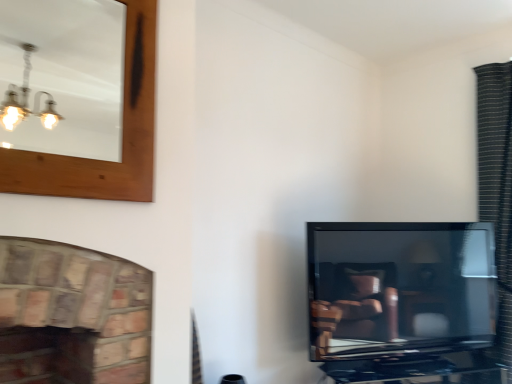
Question: Is the position of black textured curtain at right less distant than that of matte black tv at right?

Choices:
 (A) no
 (B) yes

Answer: (A)

Question: Is black textured curtain at right smaller than matte black tv at right?

Choices:
 (A) no
 (B) yes

Answer: (A)

Question: Can you confirm if black textured curtain at right is thinner than matte black tv at right?

Choices:
 (A) no
 (B) yes

Answer: (A)

Question: From the image's perspective, is black textured curtain at right under matte black tv at right?

Choices:
 (A) no
 (B) yes

Answer: (A)

Question: From a real-world perspective, does black textured curtain at right sit lower than matte black tv at right?

Choices:
 (A) yes
 (B) no

Answer: (B)

Question: Can you confirm if black textured curtain at right is positioned to the right of matte black tv at right?

Choices:
 (A) yes
 (B) no

Answer: (A)

Question: Is wooden-framed mirror at upper left located outside black textured curtain at right?

Choices:
 (A) yes
 (B) no

Answer: (A)

Question: From a real-world perspective, is wooden-framed mirror at upper left physically above black textured curtain at right?

Choices:
 (A) yes
 (B) no

Answer: (A)

Question: Considering the relative sizes of wooden-framed mirror at upper left and black textured curtain at right in the image provided, is wooden-framed mirror at upper left taller than black textured curtain at right?

Choices:
 (A) no
 (B) yes

Answer: (A)

Question: Is black textured curtain at right a part of wooden-framed mirror at upper left?

Choices:
 (A) yes
 (B) no

Answer: (B)

Question: Considering the relative positions of wooden-framed mirror at upper left and black textured curtain at right in the image provided, is wooden-framed mirror at upper left in front of black textured curtain at right?

Choices:
 (A) no
 (B) yes

Answer: (B)

Question: Is black textured curtain at right at the back of wooden-framed mirror at upper left?

Choices:
 (A) yes
 (B) no

Answer: (B)

Question: From a real-world perspective, is matte black tv at right beneath wooden-framed mirror at upper left?

Choices:
 (A) yes
 (B) no

Answer: (A)